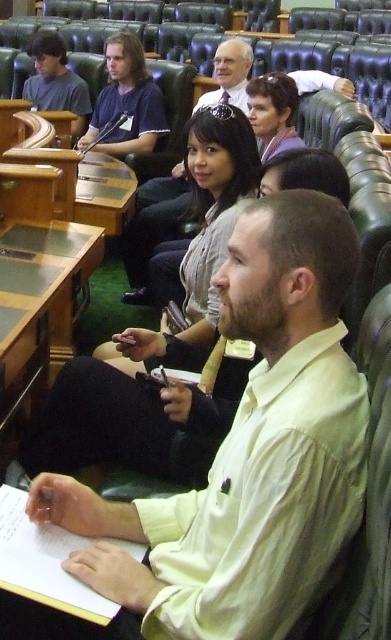
Where is `matte black shirt at center`? The width and height of the screenshot is (391, 640). matte black shirt at center is located at coordinates (127, 100).

Between light yellow shirt at center and matte black shirt at upper left, which one appears on the left side from the viewer's perspective?

matte black shirt at upper left is more to the left.

Does light yellow shirt at center appear on the right side of matte black shirt at upper left?

Yes, light yellow shirt at center is to the right of matte black shirt at upper left.

Between point (270, 212) and point (50, 77), which one is positioned in front?

Point (270, 212) is more forward.

Identify the location of light yellow shirt at center. The height and width of the screenshot is (640, 391). (249, 451).

Which of these two, light yellow shirt at center or matte black shirt at center, stands shorter?

With less height is light yellow shirt at center.

Does point (245, 458) come in front of point (116, 90)?

Yes.

At what (x,y) coordinates should I click in order to perform the action: click on light yellow shirt at center. Please return your answer as a coordinate pair (x, y). This screenshot has width=391, height=640. Looking at the image, I should click on (249, 451).